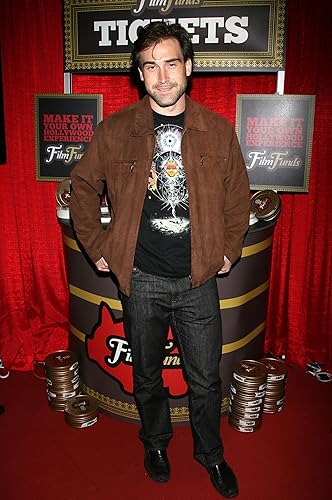
This screenshot has height=500, width=332. Identify the location of red curtains. (34, 267).